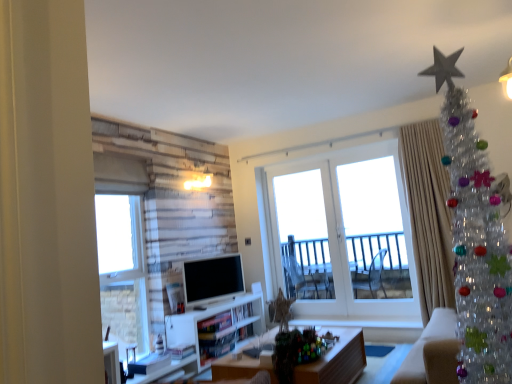
Question: Does white glass door at center, the second window when ordered from left to right, have a smaller size compared to clear plastic christmas tree at upper right?

Choices:
 (A) yes
 (B) no

Answer: (A)

Question: Is white glass door at center, which appears as the first window when viewed from the right, next to clear plastic christmas tree at upper right and touching it?

Choices:
 (A) yes
 (B) no

Answer: (B)

Question: Is white glass door at center, which is the 2th window in front-to-back order, oriented towards clear plastic christmas tree at upper right?

Choices:
 (A) yes
 (B) no

Answer: (A)

Question: From a real-world perspective, is white glass door at center, which is the 2th window in front-to-back order, below clear plastic christmas tree at upper right?

Choices:
 (A) no
 (B) yes

Answer: (B)

Question: From the image's perspective, would you say white glass door at center, which is the 2th window in front-to-back order, is shown under clear plastic christmas tree at upper right?

Choices:
 (A) no
 (B) yes

Answer: (B)

Question: From a real-world perspective, is silky beige curtain at right positioned above or below wooden desk at center?

Choices:
 (A) above
 (B) below

Answer: (A)

Question: In the image, is silky beige curtain at right on the left side or the right side of wooden desk at center?

Choices:
 (A) right
 (B) left

Answer: (A)

Question: Considering the positions of silky beige curtain at right and wooden desk at center in the image, is silky beige curtain at right bigger or smaller than wooden desk at center?

Choices:
 (A) big
 (B) small

Answer: (A)

Question: Is silky beige curtain at right taller or shorter than wooden desk at center?

Choices:
 (A) tall
 (B) short

Answer: (A)

Question: Choose the correct answer: Is silky beige curtain at right inside clear plastic christmas tree at upper right or outside it?

Choices:
 (A) inside
 (B) outside

Answer: (B)

Question: In the image, is silky beige curtain at right on the left side or the right side of clear plastic christmas tree at upper right?

Choices:
 (A) right
 (B) left

Answer: (A)

Question: Does point tap(424, 274) appear closer or farther from the camera than point tap(458, 329)?

Choices:
 (A) closer
 (B) farther

Answer: (B)

Question: Considering the positions of silky beige curtain at right and clear plastic christmas tree at upper right in the image, is silky beige curtain at right wider or thinner than clear plastic christmas tree at upper right?

Choices:
 (A) thin
 (B) wide

Answer: (A)

Question: Is white glass door at center, the first window in the back-to-front sequence, spatially inside white glossy door at center, or outside of it?

Choices:
 (A) outside
 (B) inside

Answer: (B)

Question: In terms of size, does white glass door at center, the second window when ordered from left to right, appear bigger or smaller than white glossy door at center?

Choices:
 (A) big
 (B) small

Answer: (A)